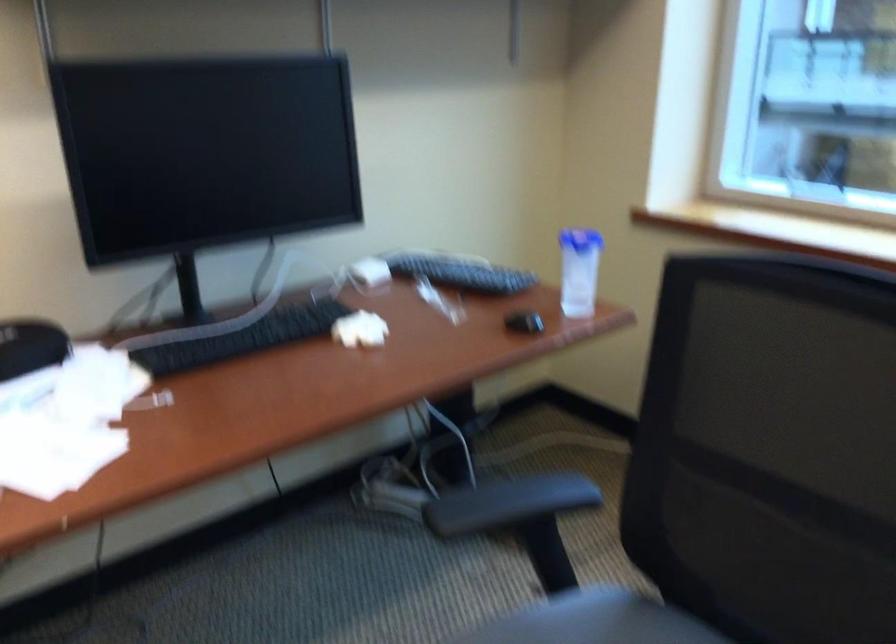
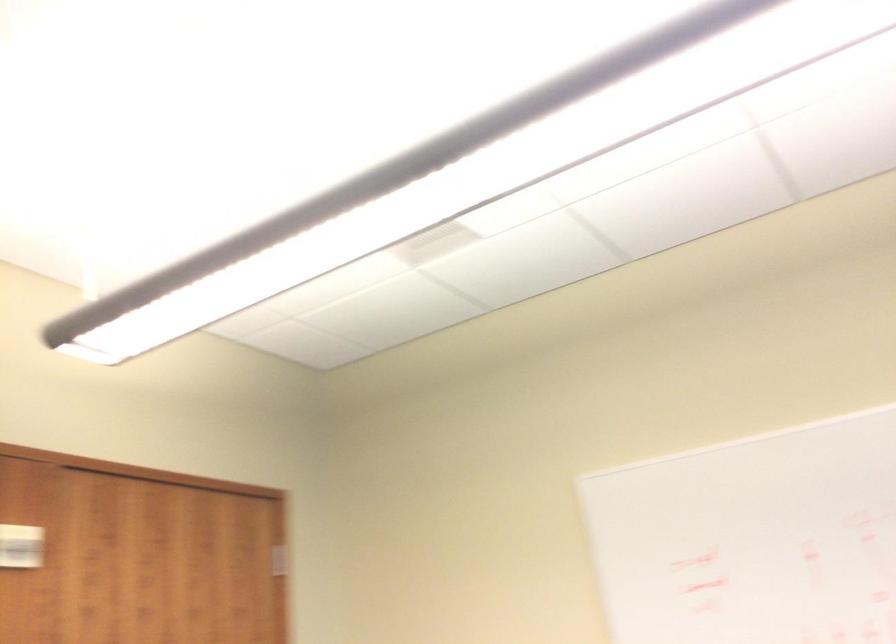
First-person continuous shooting, in which direction is the camera rotating?

The camera's rotation is toward left-up.